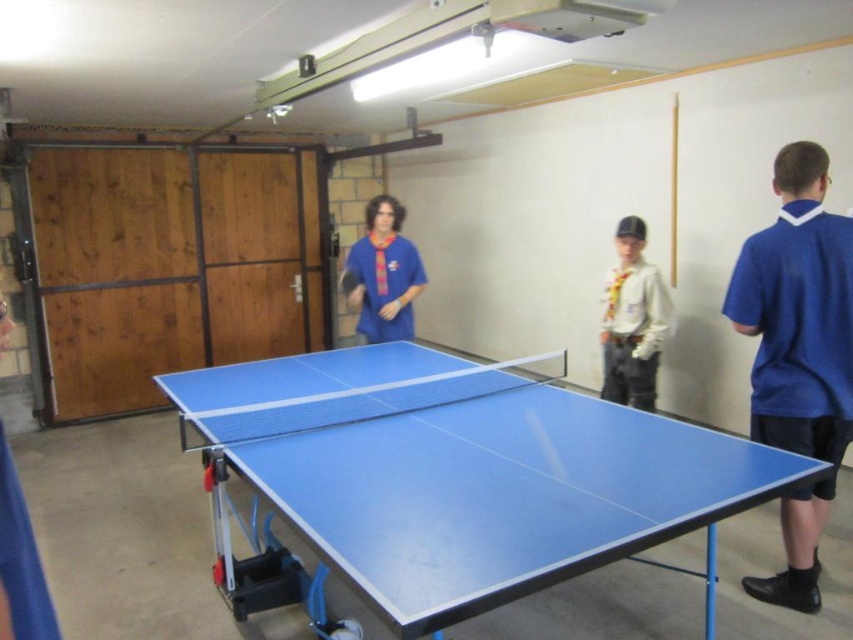
Is point (699, 483) less distant than point (339, 282)?

Yes, point (699, 483) is closer to viewer.

Identify the location of blue rubber table at center. This screenshot has width=853, height=640. (460, 474).

Is blue fabric shirt at right positioned behind blue rubber racket at center?

No, it is in front of blue rubber racket at center.

Does point (751, 406) lie behind point (344, 285)?

No, it is not.

I want to click on blue fabric shirt at right, so click(798, 355).

Does blue rubber table at center appear on the right side of matte blue shirt at center?

Correct, you'll find blue rubber table at center to the right of matte blue shirt at center.

Can you confirm if blue rubber table at center is wider than matte blue shirt at center?

Correct, the width of blue rubber table at center exceeds that of matte blue shirt at center.

Which is in front, point (257, 444) or point (396, 272)?

Positioned in front is point (257, 444).

I want to click on blue rubber table at center, so click(460, 474).